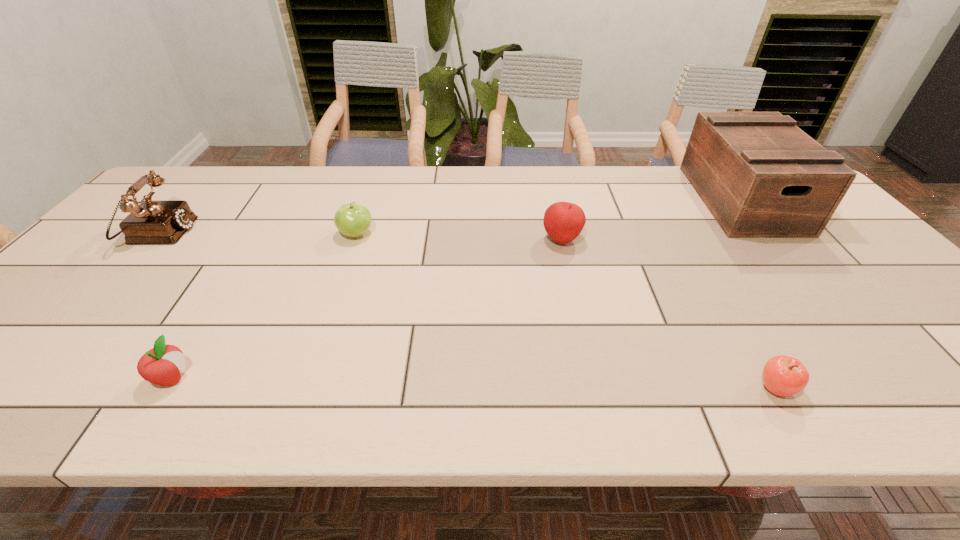
What are the coordinates of `vacant space that is in between the second object from left to right and the second apple from right to left` in the screenshot? It's located at (367, 309).

This screenshot has width=960, height=540. Identify the location of vacant area that lies between the fourth object from right to left and the leftmost apple. (264, 306).

Where is `object that is the second closest one to the third object from left to right`? object that is the second closest one to the third object from left to right is located at coordinates coord(162,365).

Identify which object is the third closest to the fourth object from right to left. Please provide its 2D coordinates. Your answer should be formatted as a tuple, i.e. [(x, y)], where the tuple contains the x and y coordinates of a point satisfying the conditions above.

[(563, 221)]

I want to click on apple that stands as the closest to the third object from right to left, so click(x=352, y=219).

Find the location of `the closest apple to the third apple from left to right`. the closest apple to the third apple from left to right is located at coordinates (352, 219).

I want to click on vacant point that satisfies the following two spatial constraints: 1. on the dial of the leftmost object; 2. on the left side of the third object from left to right, so click(156, 234).

The height and width of the screenshot is (540, 960). Identify the location of vacant space that satisfies the following two spatial constraints: 1. on the back side of the fifth object from right to left; 2. on the dial of the leftmost object. (261, 233).

At what (x,y) coordinates should I click in order to perform the action: click on vacant area in the image that satisfies the following two spatial constraints: 1. on the back side of the fifth object from right to left; 2. on the right side of the third object from left to right. Please return your answer as a coordinate pair (x, y). Looking at the image, I should click on (260, 234).

Locate an element on the screen. Image resolution: width=960 pixels, height=540 pixels. vacant region that satisfies the following two spatial constraints: 1. on the dial of the leftmost object; 2. on the right side of the fourth object from left to right is located at coordinates pos(152,240).